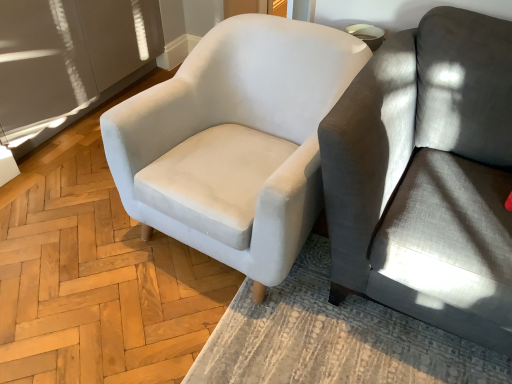
Locate an element on the screen. The width and height of the screenshot is (512, 384). free space to the left of white fabric chair at center is located at coordinates (x=69, y=229).